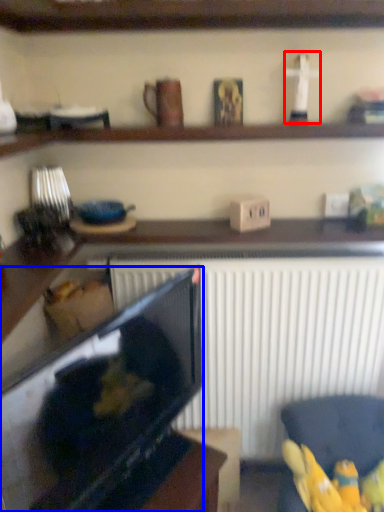
Question: Which of the following is the farthest to the observer, toy (highlighted by a red box) or appliance (highlighted by a blue box)?

Choices:
 (A) toy
 (B) appliance

Answer: (A)